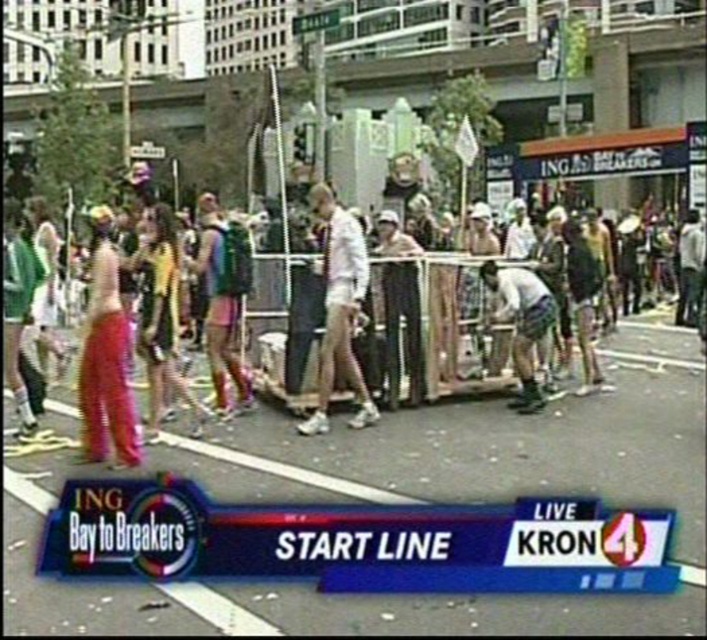
You are a participant in the race and need to check the distance between the shiny pink fabric at left and the white cotton shirt at center. If your backpack is 2 meters long, can you place it between them without folding?

The shiny pink fabric at left is 2.12 meters from the white cotton shirt at center. Since your backpack is 2 meters long, it can fit between them without folding as the distance is slightly longer than the backpack.

You are standing at the starting line of the ING Bay to Breakers race and see two points marked on the pavement. The first point is at coordinates point (117, 352), and the second point is at point (361, 385). Which point is closer to you?

Point (117, 352) is closer to the camera than point (361, 385), so the first point is closer to you.